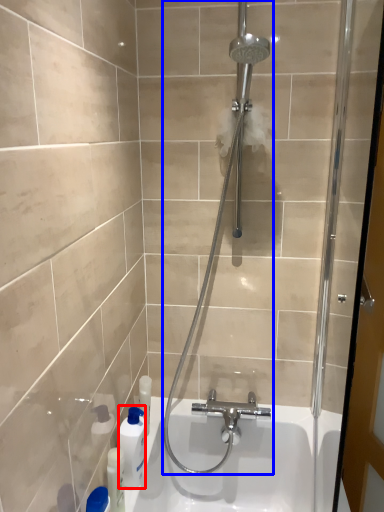
Question: Which of the following is the closest to the observer, cleaning product (highlighted by a red box) or shower (highlighted by a blue box)?

Choices:
 (A) cleaning product
 (B) shower

Answer: (B)